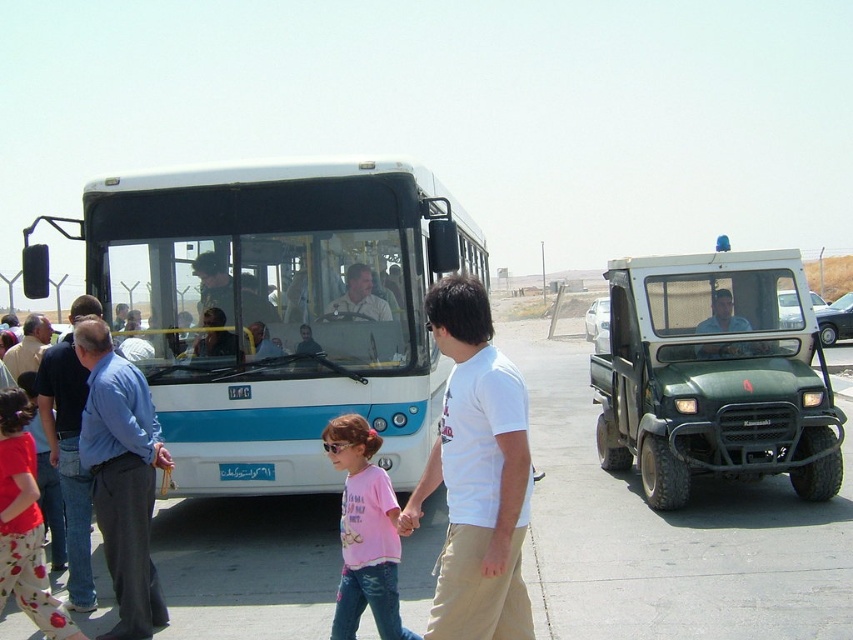
Between green matte utility vehicle at right and blue cotton shirt at left, which one appears on the right side from the viewer's perspective?

Positioned to the right is green matte utility vehicle at right.

What do you see at coordinates (714, 374) in the screenshot? I see `green matte utility vehicle at right` at bounding box center [714, 374].

The height and width of the screenshot is (640, 853). Find the location of `green matte utility vehicle at right`. green matte utility vehicle at right is located at coordinates (714, 374).

Is point (41, 326) positioned behind point (274, 356)?

Yes, it is behind point (274, 356).

Who is positioned more to the right, blue shirt at center or matte black shirt at center?

matte black shirt at center

What do you see at coordinates (28, 346) in the screenshot? I see `blue shirt at center` at bounding box center [28, 346].

Image resolution: width=853 pixels, height=640 pixels. In order to click on blue shirt at center in this screenshot , I will do `click(28, 346)`.

Is point (479, 497) in front of point (48, 424)?

That is True.

Is white cotton t-shirt at center positioned at the back of blue shirt at left?

No, white cotton t-shirt at center is in front of blue shirt at left.

Measure the distance between point (511, 499) and camera.

Point (511, 499) and camera are 3.06 meters apart.

This screenshot has width=853, height=640. In order to click on white cotton t-shirt at center in this screenshot , I will do `click(476, 474)`.